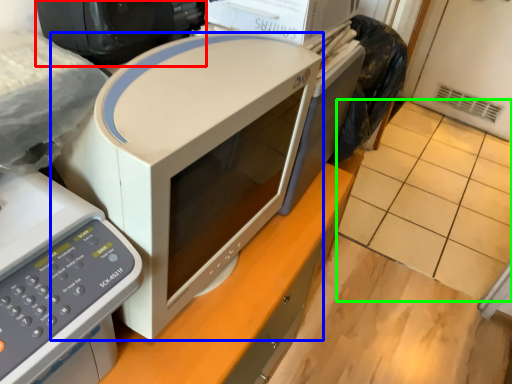
Question: Based on their relative distances, which object is nearer to desktop computer (highlighted by a red box)? Choose from home appliance (highlighted by a blue box) and tile (highlighted by a green box).

Choices:
 (A) home appliance
 (B) tile

Answer: (A)